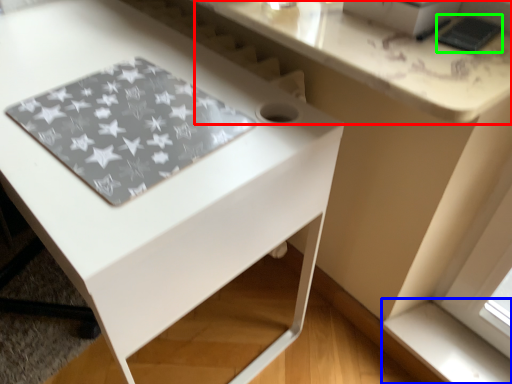
Question: Which object is the farthest from counter top (highlighted by a red box)? Choose among these: window sill (highlighted by a blue box) or pad (highlighted by a green box).

Choices:
 (A) window sill
 (B) pad

Answer: (A)